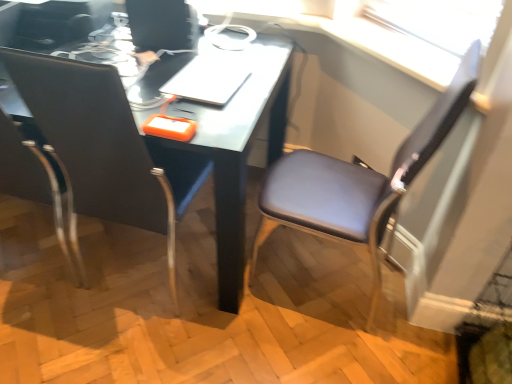
At what (x,y) coordinates should I click in order to perform the action: click on free point to the right of black leather chair at left, placed as the 1th chair when sorted from left to right. Please return your answer as a coordinate pair (x, y). The height and width of the screenshot is (384, 512). Looking at the image, I should click on (244, 291).